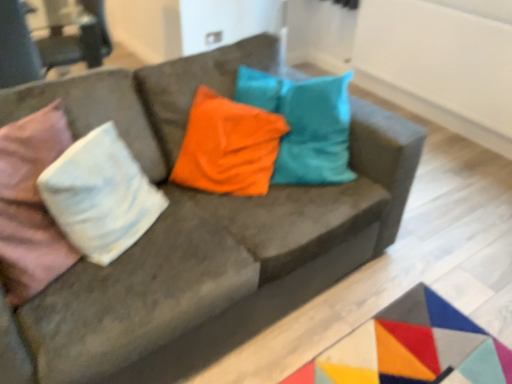
Question: Is white cotton pillow at left facing away from velvet pink armchair at upper left?

Choices:
 (A) yes
 (B) no

Answer: (B)

Question: Is velvet pink armchair at upper left a part of white cotton pillow at left?

Choices:
 (A) yes
 (B) no

Answer: (B)

Question: Does white cotton pillow at left turn towards velvet pink armchair at upper left?

Choices:
 (A) no
 (B) yes

Answer: (A)

Question: Is white cotton pillow at left not within velvet pink armchair at upper left?

Choices:
 (A) no
 (B) yes

Answer: (B)

Question: Is white cotton pillow at left at the right side of velvet pink armchair at upper left?

Choices:
 (A) no
 (B) yes

Answer: (B)

Question: Is white cotton pillow at left touching velvet pink armchair at upper left?

Choices:
 (A) yes
 (B) no

Answer: (B)

Question: Can you confirm if velvet pink armchair at upper left is thinner than white cotton pillow at left?

Choices:
 (A) yes
 (B) no

Answer: (B)

Question: Considering the relative positions of velvet pink armchair at upper left and white cotton pillow at left in the image provided, is velvet pink armchair at upper left to the left of white cotton pillow at left from the viewer's perspective?

Choices:
 (A) no
 (B) yes

Answer: (B)

Question: Does velvet pink armchair at upper left have a greater width compared to white cotton pillow at left?

Choices:
 (A) yes
 (B) no

Answer: (A)

Question: Is velvet pink armchair at upper left outside white cotton pillow at left?

Choices:
 (A) yes
 (B) no

Answer: (A)

Question: From a real-world perspective, is velvet pink armchair at upper left located higher than white cotton pillow at left?

Choices:
 (A) yes
 (B) no

Answer: (B)

Question: From a real-world perspective, is velvet pink armchair at upper left beneath white cotton pillow at left?

Choices:
 (A) no
 (B) yes

Answer: (B)

Question: Does point (66, 175) appear closer or farther from the camera than point (71, 62)?

Choices:
 (A) farther
 (B) closer

Answer: (B)